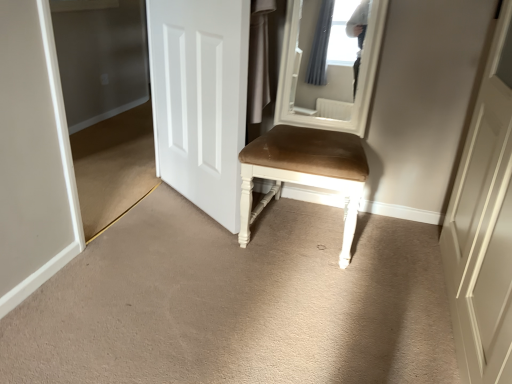
Question: Is point (243, 100) closer or farther from the camera than point (244, 233)?

Choices:
 (A) closer
 (B) farther

Answer: (A)

Question: In terms of width, does white matte door at center look wider or thinner when compared to suede-like brown chair at center?

Choices:
 (A) thin
 (B) wide

Answer: (A)

Question: Estimate the real-world distances between objects in this image. Which object is closer to the transparent glass door at left?

Choices:
 (A) suede-like brown chair at center
 (B) white matte door at center

Answer: (B)

Question: Which object is the closest to the transparent glass door at left?

Choices:
 (A) suede-like brown chair at center
 (B) white matte door at center

Answer: (B)